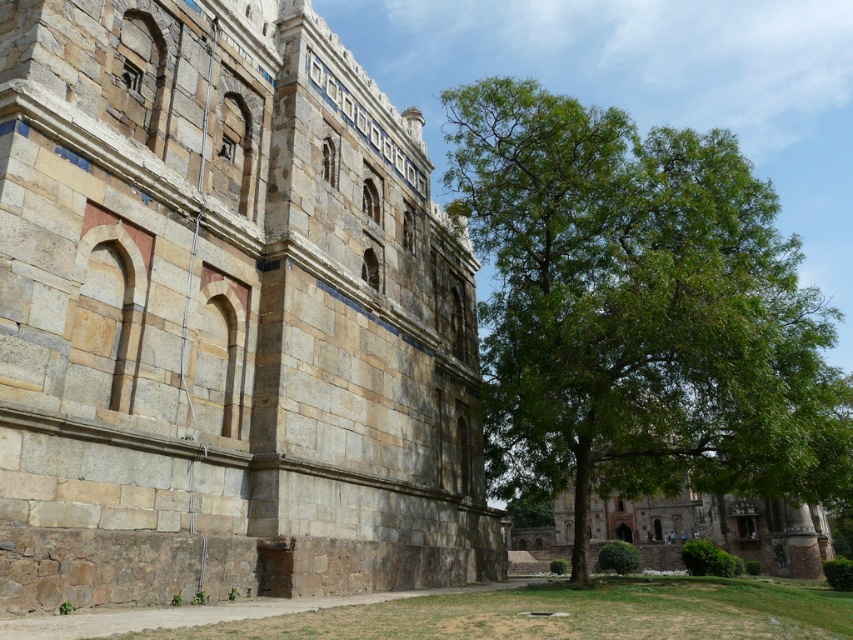
You are standing in front of the historical stone structure. You see the stone wall at center and the green leafy tree at right. Which object is positioned to the left of the other?

The stone wall at center is positioned to the left of the green leafy tree at right according to the description.

You are standing in front of the historical stone structure. You notice the stone wall at center and the green leafy tree at right. Which one appears taller from your viewpoint?

The green leafy tree at right is taller than the stone wall at center.